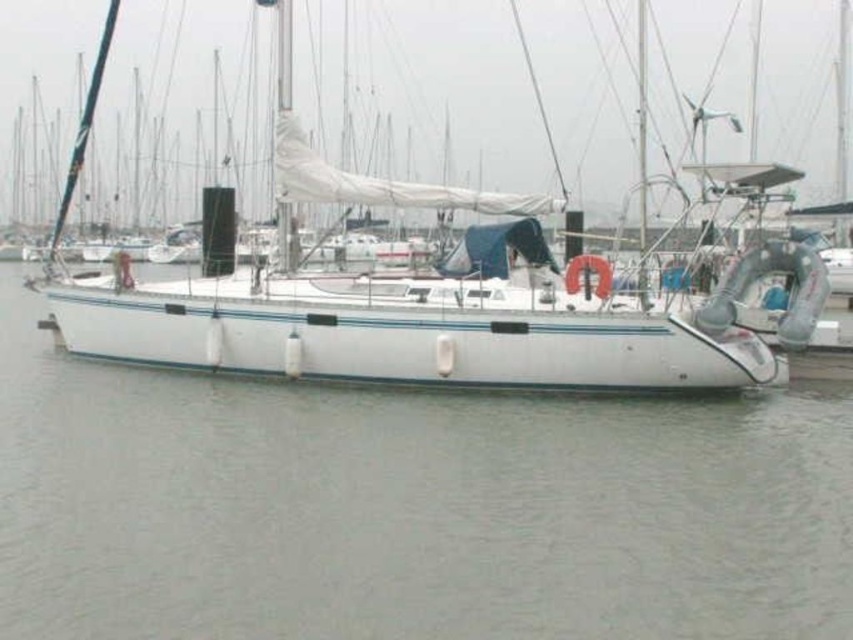
You are a photographer planning to take a photo of the white matte sailboat at center and the white matte water at center. Which object should you focus on first if you want to capture both in a single shot without moving the camera? Explain your reasoning based on their sizes in the image.

The white matte water at center is smaller than the white matte sailboat at center. To capture both in a single shot without moving the camera, you should focus on the white matte sailboat at center first since it is larger and likely the main subject, ensuring it is in sharp focus while the smaller white matte water at center will naturally be within the frame.

You are a photographer planning to capture the white matte sailboat at center and the white matte water at center in a wide shot. Based on their sizes, which object would appear wider in the photograph?

The white matte water at center would appear wider in the photograph since its width is larger than that of the white matte sailboat at center according to the description.

You are standing on the dock and looking at the white sailboat. There are two points marked on the boat. One is at coordinate point (x=4, y=536) and the other is at point (x=103, y=61). Which point is closer to you?

Point (x=4, y=536) is closer to the viewer than point (x=103, y=61).